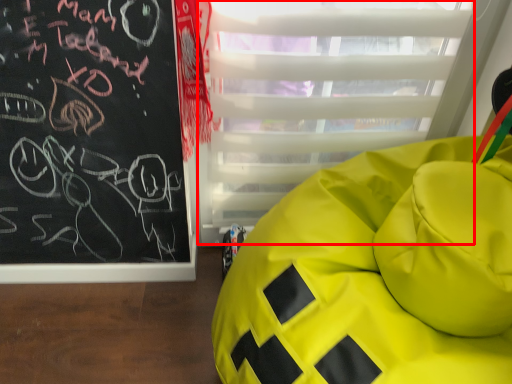
Question: From the image's perspective, what is the correct spatial relationship of glass door (annotated by the red box) in relation to furniture?

Choices:
 (A) above
 (B) below

Answer: (A)